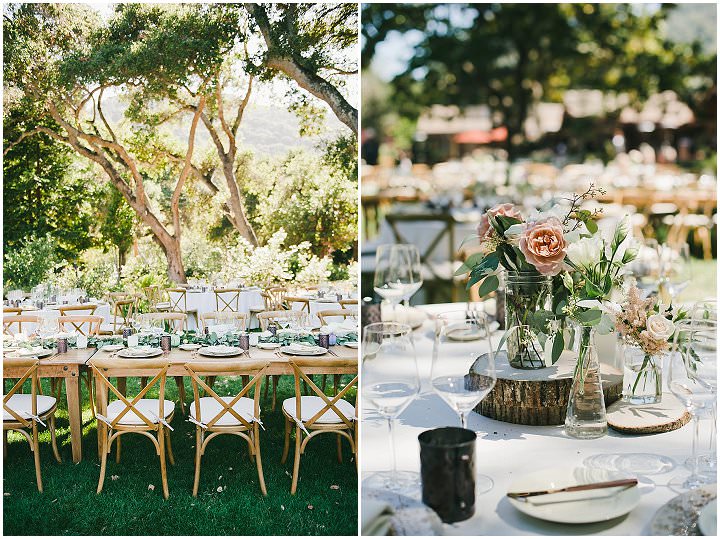
You are a GUI agent. You are given a task and a screenshot of the screen. Output one action in this format:
    pyautogui.click(x=<x>, y=<y>)
    Task: Click on the vase
    
    Given the screenshot: What is the action you would take?
    pyautogui.click(x=585, y=398)